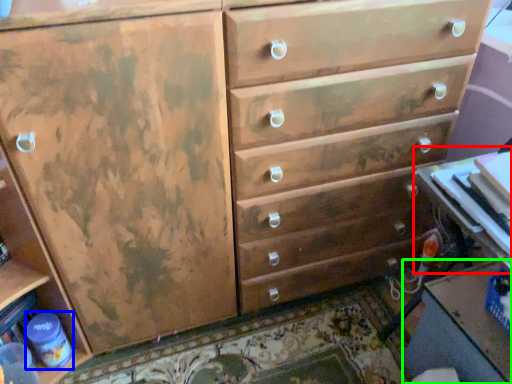
Question: Estimate the real-world distances between objects in this image. Which object is farther from table (highlighted by a red box), bottle (highlighted by a blue box) or table (highlighted by a green box)?

Choices:
 (A) bottle
 (B) table

Answer: (A)